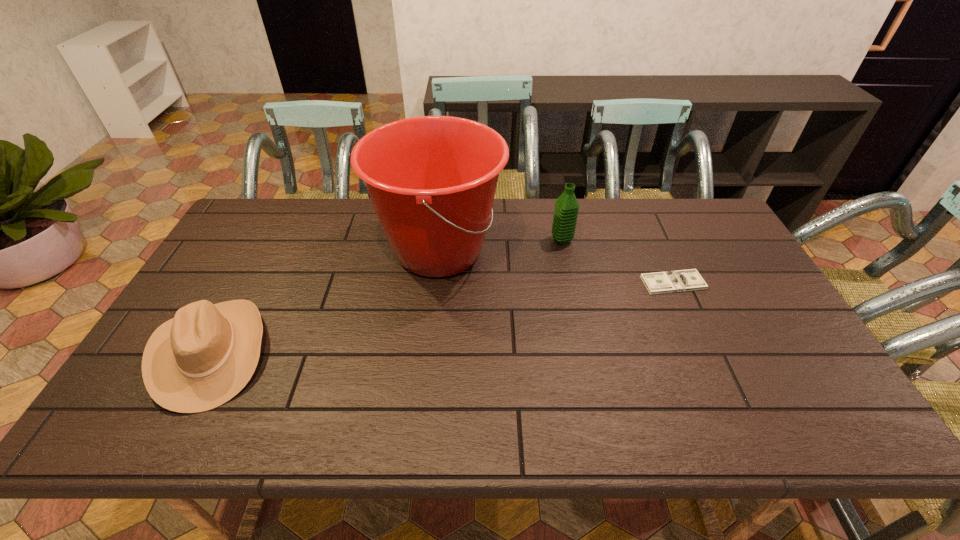
This screenshot has width=960, height=540. Find the location of `vacant space located 0.080m on the back of the cowboy hat`. vacant space located 0.080m on the back of the cowboy hat is located at coordinates (249, 282).

Find the location of a particular element. vacant space located on the right of the shortest object is located at coordinates (734, 283).

Find the location of a particular element. bucket present at the far edge is located at coordinates (432, 180).

At what (x,y) coordinates should I click in order to perform the action: click on water bottle at the far edge. Please return your answer as a coordinate pair (x, y). Looking at the image, I should click on (566, 209).

Locate an element on the screen. This screenshot has width=960, height=540. object located at the near edge is located at coordinates (204, 356).

The image size is (960, 540). Identify the location of object located in the left edge section of the desktop. (204, 356).

Where is `object situated at the near left corner`? The width and height of the screenshot is (960, 540). object situated at the near left corner is located at coordinates (204, 356).

Locate an element on the screen. free region at the far edge of the desktop is located at coordinates (335, 228).

You are a GUI agent. You are given a task and a screenshot of the screen. Output one action in this format:
    pyautogui.click(x=<x>, y=<y>)
    Task: Click on the free spot at the near edge of the desktop
    
    Given the screenshot: What is the action you would take?
    pyautogui.click(x=523, y=413)

In the image, there is a desktop. Identify the location of vacant area at the right edge. The width and height of the screenshot is (960, 540). (763, 324).